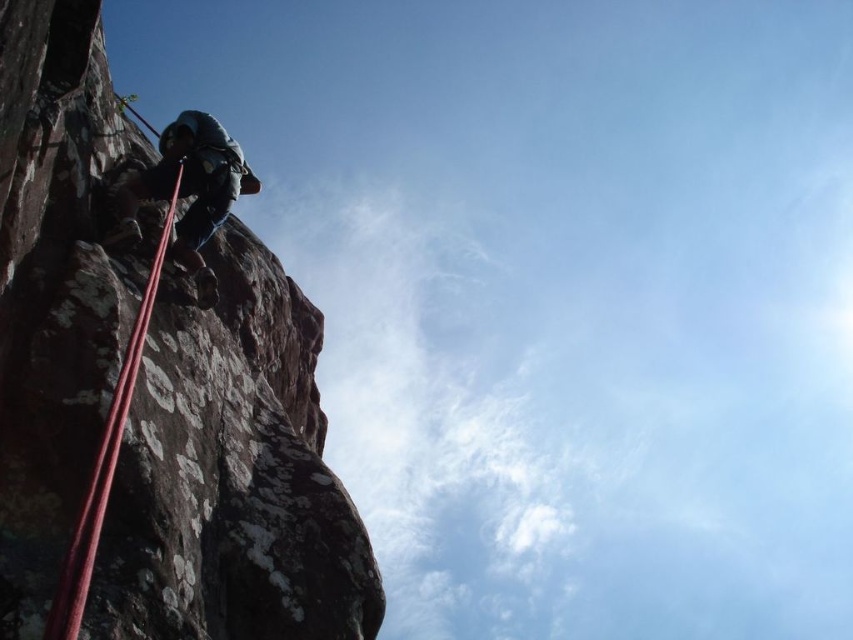
What do you see at coordinates (231, 476) in the screenshot? This screenshot has width=853, height=640. I see `brown rough rock at left` at bounding box center [231, 476].

Between brown rough rock at left and dark blue fabric climbing harness at left, which one has more height?

brown rough rock at left

At what (x,y) coordinates should I click in order to perform the action: click on brown rough rock at left. Please return your answer as a coordinate pair (x, y). This screenshot has width=853, height=640. Looking at the image, I should click on (231, 476).

Who is shorter, brown rough rock at left or red nylon rope at left?

With less height is red nylon rope at left.

Does point (216, 576) lie in front of point (102, 476)?

No, it is not.

Describe the element at coordinates (231, 476) in the screenshot. Image resolution: width=853 pixels, height=640 pixels. I see `brown rough rock at left` at that location.

Find the location of a particular element. brown rough rock at left is located at coordinates (231, 476).

Is dark blue fabric climbing harness at left bigger than red nylon rope at left?

Incorrect, dark blue fabric climbing harness at left is not larger than red nylon rope at left.

Identify the location of dark blue fabric climbing harness at left. The image size is (853, 640). (189, 189).

The image size is (853, 640). Identify the location of dark blue fabric climbing harness at left. (189, 189).